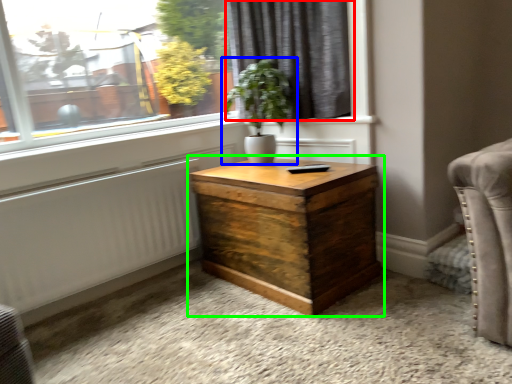
Question: Estimate the real-world distances between objects in this image. Which object is farther from curtain (highlighted by a red box), houseplant (highlighted by a blue box) or nightstand (highlighted by a green box)?

Choices:
 (A) houseplant
 (B) nightstand

Answer: (B)